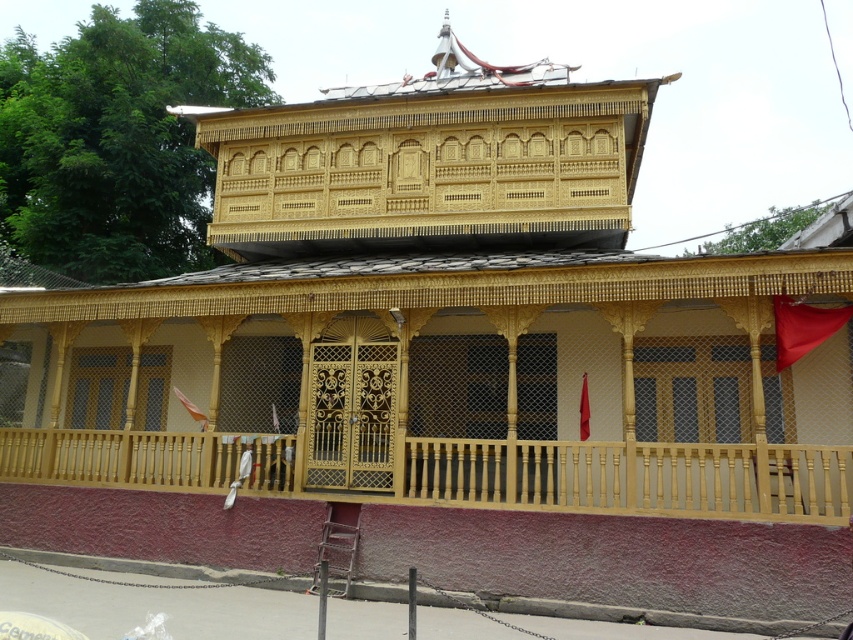
Does matte gold balcony at center have a lesser width compared to smooth wood balcony at center?

Incorrect, matte gold balcony at center's width is not less than smooth wood balcony at center's.

What are the coordinates of `matte gold balcony at center` in the screenshot? It's located at (447, 381).